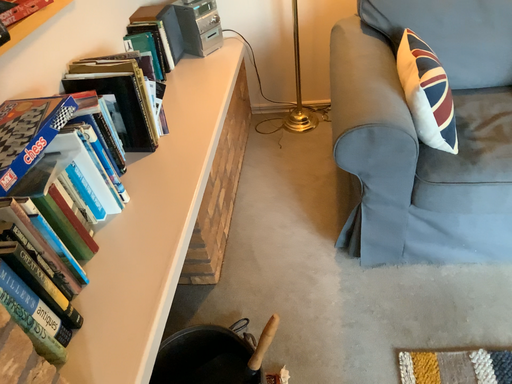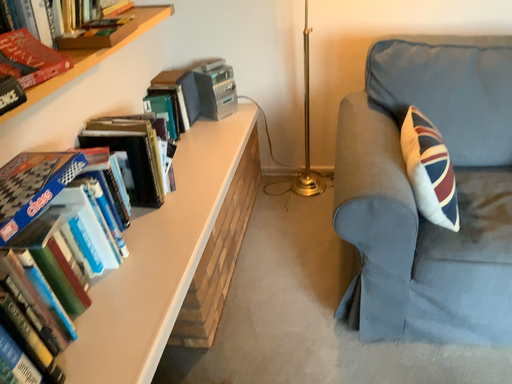
Question: Which way did the camera rotate in the video?

Choices:
 (A) rotated downward
 (B) rotated upward

Answer: (B)